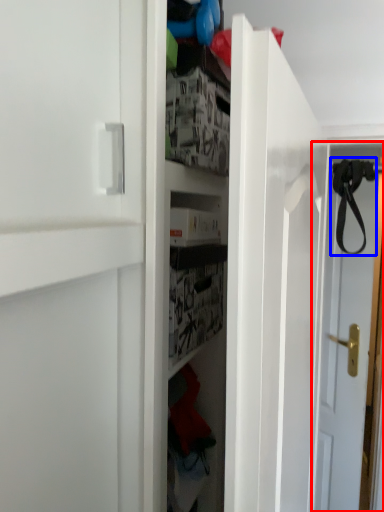
Question: Which of the following is the farthest to the observer, door (highlighted by a red box) or strap (highlighted by a blue box)?

Choices:
 (A) door
 (B) strap

Answer: (A)